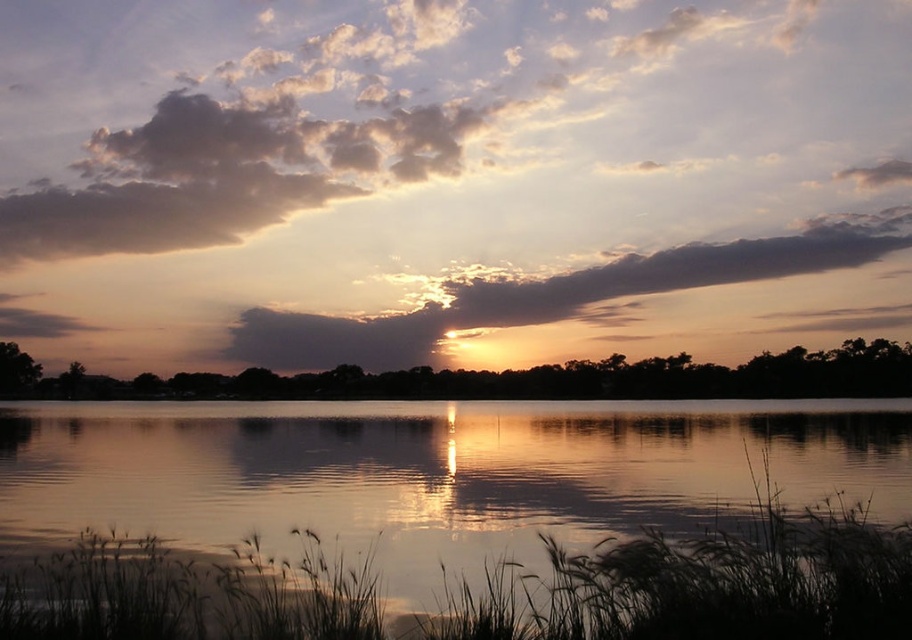
You are an astronomer observing the sunset and notice two clouds in the sky. The first is the cloudy sky at upper center and the second is the smokey gray cloud at upper center. Which cloud is located to the left of the other?

The cloudy sky at upper center is positioned on the left side of smokey gray cloud at upper center, so the cloudy sky at upper center is to the left of the smokey gray cloud at upper center.

You are an artist trying to paint the sunset scene. You need to decide which area to focus on first based on their widths. Which one is wider, the cloudy sky at upper center or the silvery reflective water at center?

The cloudy sky at upper center might be wider than silvery reflective water at center, so focus on painting the cloudy sky at upper center first as it could require more space.

You are standing at the edge of the water and want to take a photo of the sunset reflection. Where should you position yourself to capture the silvery reflective water at center in the best possible way?

To capture the silvery reflective water at center best, position yourself at point (486,490) where the reflection is located.